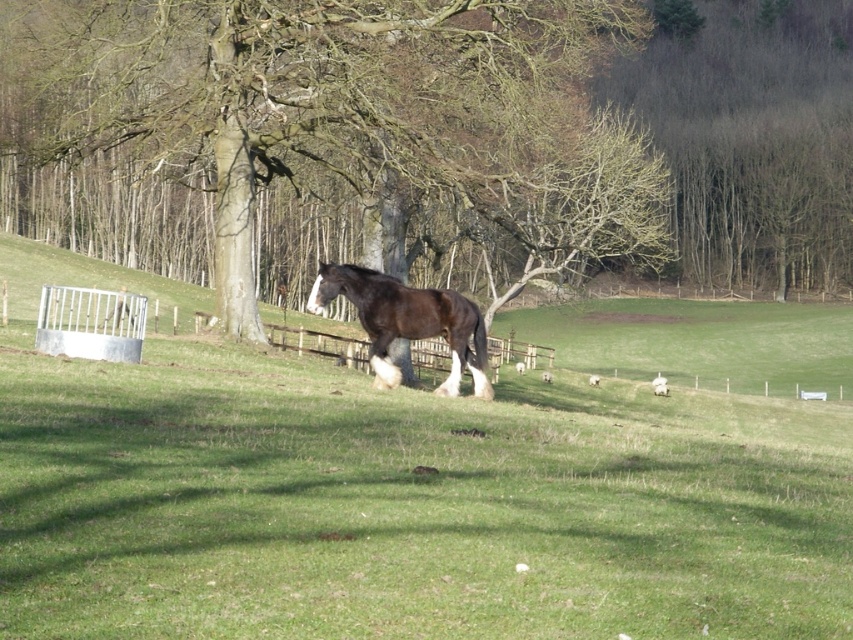
Question: Is the position of brown bark tree at center more distant than that of brown glossy horse at center?

Choices:
 (A) yes
 (B) no

Answer: (A)

Question: Is brown bark tree at center smaller than brown glossy horse at center?

Choices:
 (A) yes
 (B) no

Answer: (B)

Question: Is brown bark tree at center wider than brown glossy horse at center?

Choices:
 (A) no
 (B) yes

Answer: (B)

Question: Among these objects, which one is farthest from the camera?

Choices:
 (A) brown glossy horse at center
 (B) brown bark tree at center

Answer: (B)

Question: Among these objects, which one is nearest to the camera?

Choices:
 (A) brown bark tree at center
 (B) brown glossy horse at center

Answer: (B)